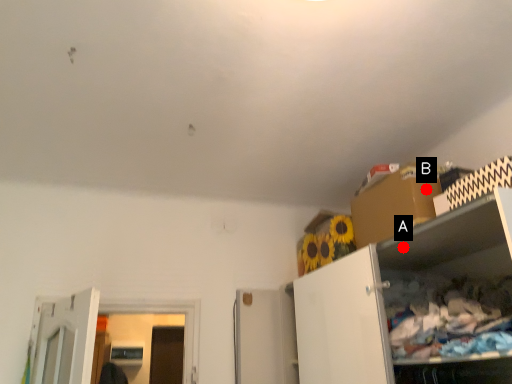
Question: Two points are circled on the image, labeled by A and B beside each circle. Which point is closer to the camera?

Choices:
 (A) A is closer
 (B) B is closer

Answer: (A)